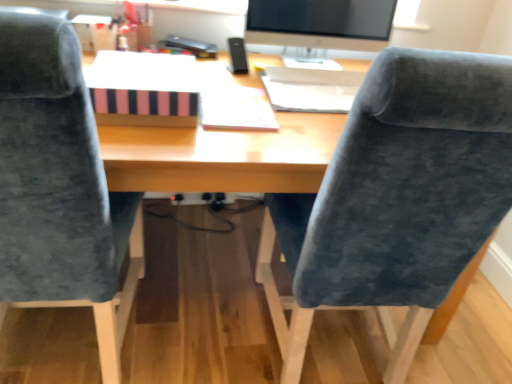
This screenshot has height=384, width=512. Find the location of `white paper at center`. white paper at center is located at coordinates (236, 109).

The width and height of the screenshot is (512, 384). What do you see at coordinates (59, 186) in the screenshot?
I see `velvet blue chair at left, which is counted as the first chair, starting from the left` at bounding box center [59, 186].

Where is `pink striped paper at center, positioned as the second book in right-to-left order`? pink striped paper at center, positioned as the second book in right-to-left order is located at coordinates (143, 89).

Locate an element on the screen. This screenshot has height=384, width=512. white paper at upper center, which ranks as the second book in left-to-right order is located at coordinates (311, 89).

What do you see at coordinates (321, 23) in the screenshot? I see `satin black monitor at upper center` at bounding box center [321, 23].

Locate an element on the screen. Image resolution: width=512 pixels, height=384 pixels. white paper at center is located at coordinates [236, 109].

This screenshot has height=384, width=512. What are the coordinates of `notebook below the satin black monitor at upper center (from the image's perspective)` in the screenshot? It's located at (236, 109).

From a real-world perspective, does satin black monitor at upper center sit lower than white paper at center?

No, from a real-world perspective, satin black monitor at upper center is not below white paper at center.

From the image's perspective, which one is positioned higher, satin black monitor at upper center or white paper at center?

satin black monitor at upper center appears higher in the image.

Which of these two, satin black monitor at upper center or white paper at center, is bigger?

With larger size is satin black monitor at upper center.

The image size is (512, 384). What are the coordinates of `chair on the right of white paper at upper center, positioned as the 1th book in right-to-left order` in the screenshot? It's located at (397, 197).

Is white paper at upper center, which ranks as the second book in left-to-right order, wider than velvet blue chair at right, which is the first chair from right to left?

In fact, white paper at upper center, which ranks as the second book in left-to-right order, might be narrower than velvet blue chair at right, which is the first chair from right to left.

Considering the positions of points (360, 77) and (418, 68), is point (360, 77) farther from camera compared to point (418, 68)?

Yes, it is behind point (418, 68).

From the image's perspective, which is above, velvet blue chair at right, acting as the second chair starting from the left, or pink striped paper at center, positioned as the first book in left-to-right order?

pink striped paper at center, positioned as the first book in left-to-right order, from the image's perspective.

Is velvet blue chair at right, acting as the second chair starting from the left, in front of or behind pink striped paper at center, positioned as the second book in right-to-left order, in the image?

Visually, velvet blue chair at right, acting as the second chair starting from the left, is located in front of pink striped paper at center, positioned as the second book in right-to-left order.

Would you say velvet blue chair at right, which is the first chair from right to left, is outside pink striped paper at center, positioned as the second book in right-to-left order?

velvet blue chair at right, which is the first chair from right to left, is positioned outside pink striped paper at center, positioned as the second book in right-to-left order.

From a real-world perspective, is velvet blue chair at right, which is the first chair from right to left, beneath pink striped paper at center, positioned as the first book in left-to-right order?

Correct, in the physical world, velvet blue chair at right, which is the first chair from right to left, is lower than pink striped paper at center, positioned as the first book in left-to-right order.

From a real-world perspective, who is located higher, white paper at upper center, positioned as the 1th book in right-to-left order, or velvet blue chair at left, which is counted as the first chair, starting from the left?

From a 3D spatial view, white paper at upper center, positioned as the 1th book in right-to-left order, is above.

Does white paper at upper center, positioned as the 1th book in right-to-left order, come behind velvet blue chair at left, which is counted as the 2th chair, starting from the right?

Yes, white paper at upper center, positioned as the 1th book in right-to-left order, is further from the camera.

Is the surface of white paper at upper center, positioned as the 1th book in right-to-left order, in direct contact with velvet blue chair at left, which is counted as the first chair, starting from the left?

No, white paper at upper center, positioned as the 1th book in right-to-left order, is not beside velvet blue chair at left, which is counted as the first chair, starting from the left.

Considering the sizes of objects white paper at upper center, positioned as the 1th book in right-to-left order, and velvet blue chair at left, which is counted as the first chair, starting from the left, in the image provided, who is taller, white paper at upper center, positioned as the 1th book in right-to-left order, or velvet blue chair at left, which is counted as the first chair, starting from the left,?

velvet blue chair at left, which is counted as the first chair, starting from the left.

Is white paper at center positioned in front of black plastic remote at center?

Yes, it is.

Which of these two, white paper at center or black plastic remote at center, stands shorter?

With less height is white paper at center.

Are white paper at center and black plastic remote at center located far from each other?

white paper at center is near black plastic remote at center, not far away.

From the image's perspective, which is above, white paper at center or black plastic remote at center?

black plastic remote at center, from the image's perspective.

Is velvet blue chair at left, which is counted as the 2th chair, starting from the right, wider than satin black monitor at upper center?

Indeed, velvet blue chair at left, which is counted as the 2th chair, starting from the right, has a greater width compared to satin black monitor at upper center.

From a real-world perspective, who is located higher, velvet blue chair at left, which is counted as the 2th chair, starting from the right, or satin black monitor at upper center?

In real-world perspective, satin black monitor at upper center is above.

Is velvet blue chair at left, which is counted as the first chair, starting from the left, far from satin black monitor at upper center?

No, velvet blue chair at left, which is counted as the first chair, starting from the left, is not far from satin black monitor at upper center.

Considering the relative positions of velvet blue chair at left, which is counted as the first chair, starting from the left, and satin black monitor at upper center in the image provided, is velvet blue chair at left, which is counted as the first chair, starting from the left, in front of satin black monitor at upper center?

Yes, velvet blue chair at left, which is counted as the first chair, starting from the left, is closer to the camera.

Consider the image. From the image's perspective, who appears lower, white paper at upper center, positioned as the 1th book in right-to-left order, or pink striped paper at center, positioned as the second book in right-to-left order?

pink striped paper at center, positioned as the second book in right-to-left order.

Which of these two, white paper at upper center, positioned as the 1th book in right-to-left order, or pink striped paper at center, positioned as the second book in right-to-left order, stands shorter?

Standing shorter between the two is white paper at upper center, positioned as the 1th book in right-to-left order.

Is there a large distance between white paper at upper center, which ranks as the second book in left-to-right order, and pink striped paper at center, positioned as the first book in left-to-right order?

That's not correct — white paper at upper center, which ranks as the second book in left-to-right order, is a little close to pink striped paper at center, positioned as the first book in left-to-right order.

Is pink striped paper at center, positioned as the first book in left-to-right order, inside white paper at upper center, positioned as the 1th book in right-to-left order?

No, pink striped paper at center, positioned as the first book in left-to-right order, is not inside white paper at upper center, positioned as the 1th book in right-to-left order.

Where is `computer monitor located above the white paper at center (from a real-world perspective)`? computer monitor located above the white paper at center (from a real-world perspective) is located at coordinates (321, 23).

Where is `chair that is the 2nd one when counting downward from the white paper at upper center, positioned as the 1th book in right-to-left order (from the image's perspective)`? Image resolution: width=512 pixels, height=384 pixels. chair that is the 2nd one when counting downward from the white paper at upper center, positioned as the 1th book in right-to-left order (from the image's perspective) is located at coordinates (397, 197).

Looking at the image, which one is located further to satin black monitor at upper center, white paper at center or white paper at upper center, which ranks as the second book in left-to-right order?

Based on the image, white paper at center appears to be further to satin black monitor at upper center.

Estimate the real-world distances between objects in this image. Which object is further from black plastic remote at center, white paper at center or white paper at upper center, which ranks as the second book in left-to-right order?

white paper at center is positioned further to the anchor black plastic remote at center.

Looking at this image, considering their positions, is satin black monitor at upper center positioned further to pink striped paper at center, positioned as the first book in left-to-right order, than white paper at center?

The object further to pink striped paper at center, positioned as the first book in left-to-right order, is satin black monitor at upper center.

Looking at the image, which one is located closer to white paper at center, black plastic remote at center or white paper at upper center, which ranks as the second book in left-to-right order?

white paper at upper center, which ranks as the second book in left-to-right order.

When comparing their distances from pink striped paper at center, positioned as the first book in left-to-right order, does velvet blue chair at left, which is counted as the 2th chair, starting from the right, or white paper at upper center, positioned as the 1th book in right-to-left order, seem further?

The object further to pink striped paper at center, positioned as the first book in left-to-right order, is white paper at upper center, positioned as the 1th book in right-to-left order.

Looking at the image, which one is located further to black plastic remote at center, satin black monitor at upper center or pink striped paper at center, positioned as the second book in right-to-left order?

pink striped paper at center, positioned as the second book in right-to-left order, lies further to black plastic remote at center than the other object.

Based on their spatial positions, is white paper at upper center, which ranks as the second book in left-to-right order, or black plastic remote at center closer to velvet blue chair at right, which is the first chair from right to left?

white paper at upper center, which ranks as the second book in left-to-right order.

In the scene shown: Estimate the real-world distances between objects in this image. Which object is closer to satin black monitor at upper center, white paper at upper center, which ranks as the second book in left-to-right order, or velvet blue chair at right, which is the first chair from right to left?

white paper at upper center, which ranks as the second book in left-to-right order, lies closer to satin black monitor at upper center than the other object.

Locate an element on the screen. notebook between pink striped paper at center, positioned as the second book in right-to-left order, and white paper at upper center, which ranks as the second book in left-to-right order is located at coordinates (236, 109).

Where is `notebook between velvet blue chair at right, acting as the second chair starting from the left, and white paper at upper center, positioned as the 1th book in right-to-left order, from front to back`? notebook between velvet blue chair at right, acting as the second chair starting from the left, and white paper at upper center, positioned as the 1th book in right-to-left order, from front to back is located at coordinates (236, 109).

The width and height of the screenshot is (512, 384). Identify the location of notebook between velvet blue chair at left, which is counted as the 2th chair, starting from the right, and satin black monitor at upper center, along the z-axis. (x=236, y=109).

Locate an element on the screen. chair positioned between velvet blue chair at left, which is counted as the 2th chair, starting from the right, and black plastic remote at center from near to far is located at coordinates (397, 197).